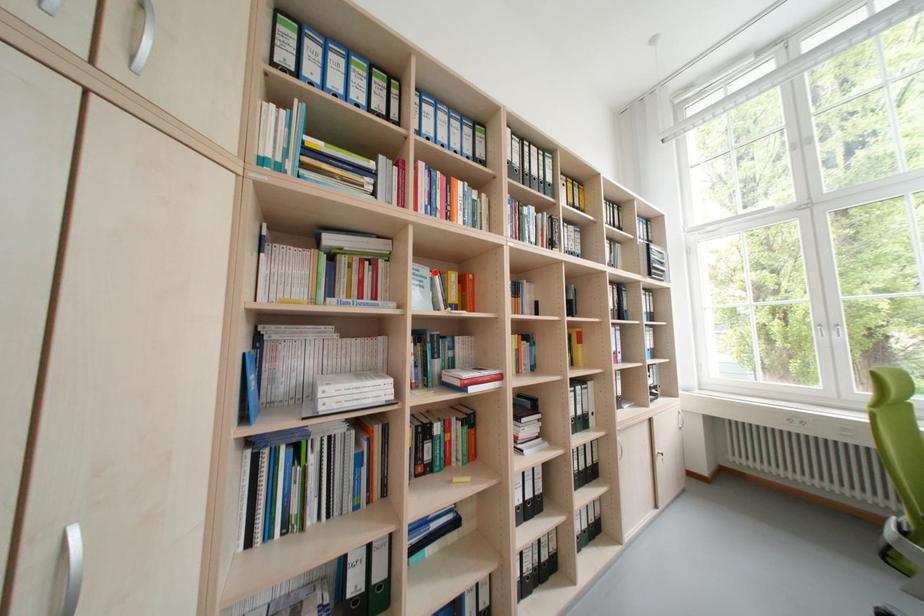
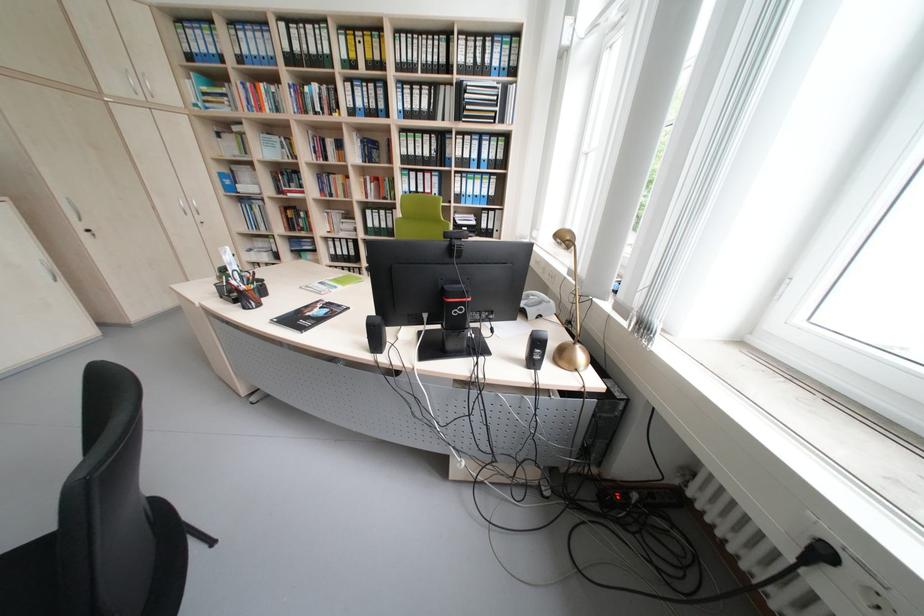
Locate, in the second image, the point that corresponds to the highlighted location in the first image.

(286, 140)